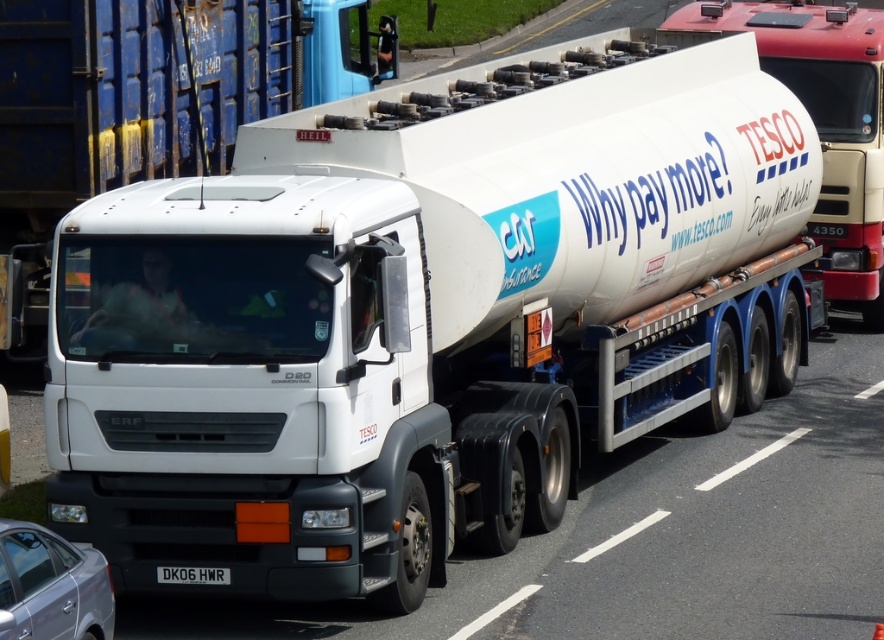
Which is above, white glossy tanker at center or black metal/license plate at lower center?

white glossy tanker at center is above.

Image resolution: width=884 pixels, height=640 pixels. I want to click on white glossy tanker at center, so click(x=822, y=124).

Find the location of a particular element. white glossy tanker at center is located at coordinates coord(822,124).

Does white matte truck at center have a lesser height compared to black metal/license plate at lower center?

In fact, white matte truck at center may be taller than black metal/license plate at lower center.

Is white matte truck at center thinner than black metal/license plate at lower center?

No, white matte truck at center is not thinner than black metal/license plate at lower center.

What are the coordinates of `white matte truck at center` in the screenshot? It's located at (146, 106).

Which is below, white matte truck at center or white glossy tanker at center?

white glossy tanker at center

Which is more to the right, white matte truck at center or white glossy tanker at center?

Positioned to the right is white glossy tanker at center.

Is point (265, 92) farther from viewer compared to point (860, 45)?

No, (265, 92) is in front of (860, 45).

Find the location of a particular element. The height and width of the screenshot is (640, 884). white matte truck at center is located at coordinates (146, 106).